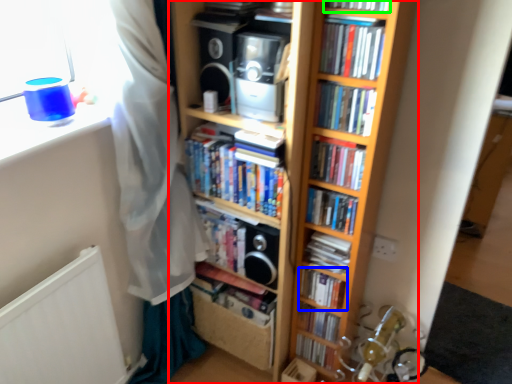
Question: Estimate the real-world distances between objects in this image. Which object is farther from bookcase (highlighted by a red box), book (highlighted by a blue box) or book (highlighted by a green box)?

Choices:
 (A) book
 (B) book

Answer: (B)